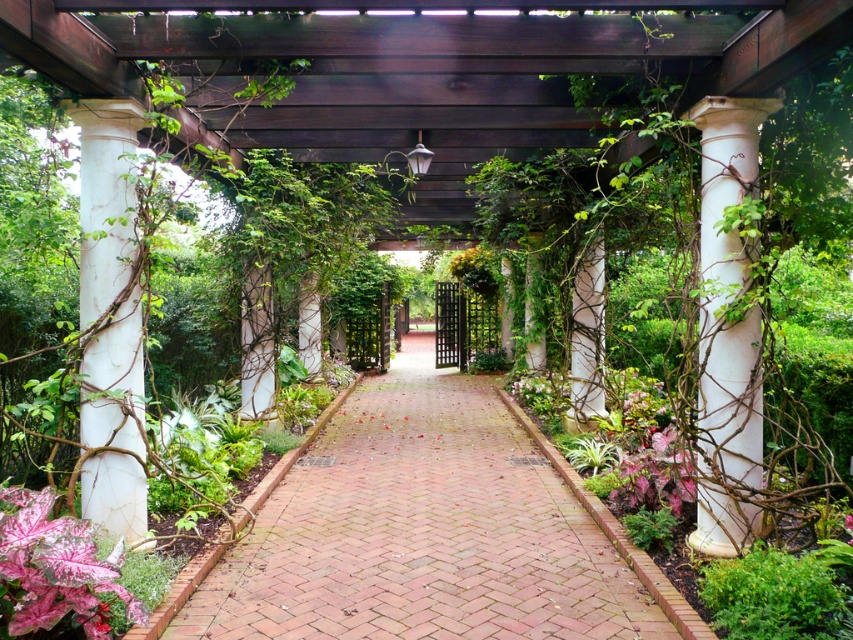
Question: Estimate the real-world distances between objects in this image. Which object is farther from the white marble column at center?

Choices:
 (A) pink variegated leaf at lower left
 (B) white marble column at left
 (C) white marble column at right

Answer: (A)

Question: In this image, where is white marble column at center located relative to pink matte leaf at lower right?

Choices:
 (A) below
 (B) above

Answer: (B)

Question: Is brick at center below white marble column at center?

Choices:
 (A) no
 (B) yes

Answer: (B)

Question: Which of the following is the farthest from the observer?

Choices:
 (A) (674, 509)
 (B) (334, 536)

Answer: (B)

Question: Considering the real-world distances, which object is farthest from the brick at center?

Choices:
 (A) pink matte leaf at lower right
 (B) white marble column at left

Answer: (B)

Question: Does white marble column at right lie behind white marble column at center?

Choices:
 (A) yes
 (B) no

Answer: (B)